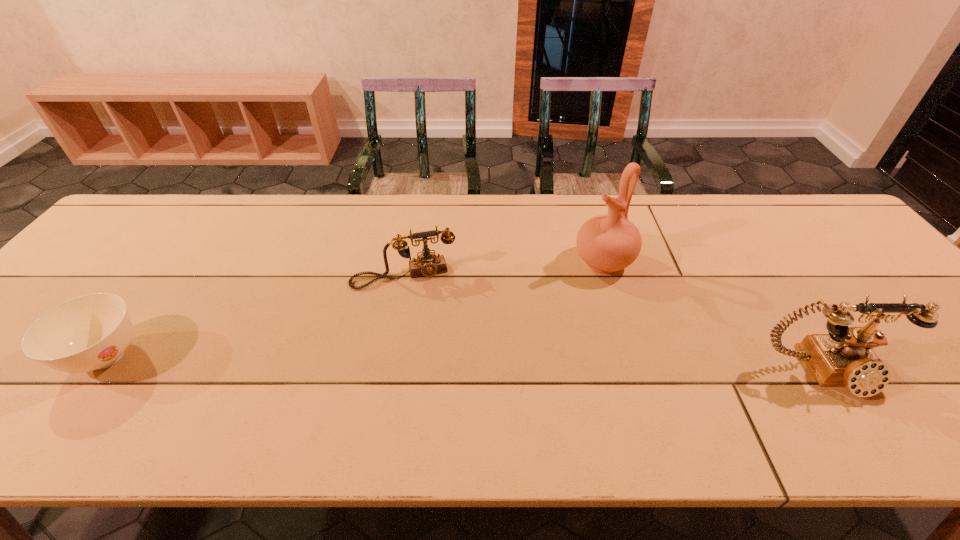
Where is `free region located on the spout of the third object from left to right`? The height and width of the screenshot is (540, 960). free region located on the spout of the third object from left to right is located at coordinates (521, 330).

Identify the location of vacant point located 0.140m on the spout of the third object from left to right. (553, 304).

This screenshot has width=960, height=540. What are the coordinates of `free region located 0.260m on the front-facing side of the second object from left to right` in the screenshot? It's located at tap(431, 374).

This screenshot has height=540, width=960. Identify the location of free space located on the front-facing side of the second object from left to right. (431, 374).

This screenshot has width=960, height=540. Identify the location of free space located 0.310m on the front-facing side of the second object from left to right. 435,394.

What are the coordinates of `sugar bowl that is at the near edge` in the screenshot? It's located at tap(91, 332).

The image size is (960, 540). What are the coordinates of `telephone present at the near edge` in the screenshot? It's located at (843, 358).

The width and height of the screenshot is (960, 540). I want to click on object that is at the left edge, so click(91, 332).

The image size is (960, 540). I want to click on object at the near left corner, so click(91, 332).

This screenshot has height=540, width=960. What are the coordinates of `vacant space at the far edge of the desktop` in the screenshot? It's located at (345, 216).